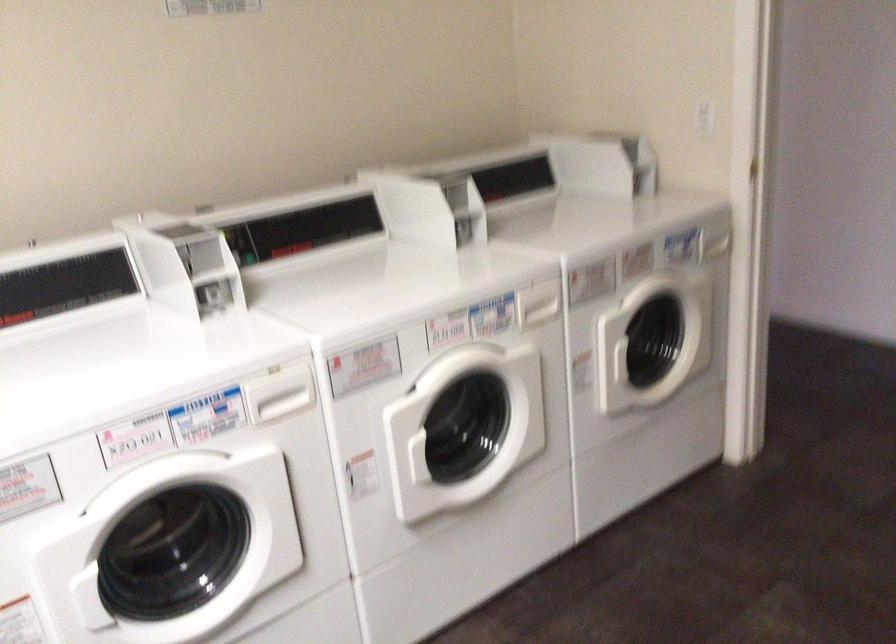
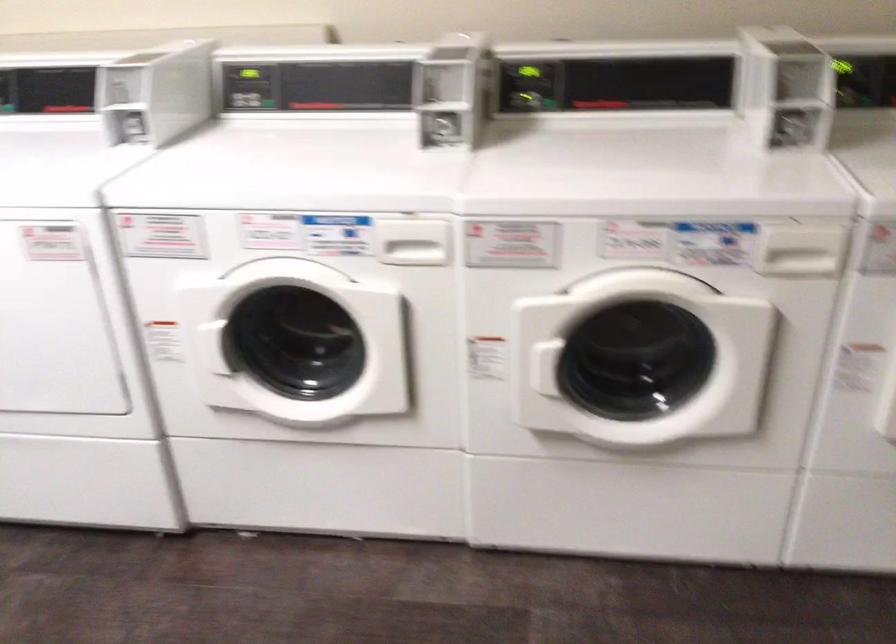
Where in the second image is the point corresponding to pixel 271 406 from the first image?

(409, 251)